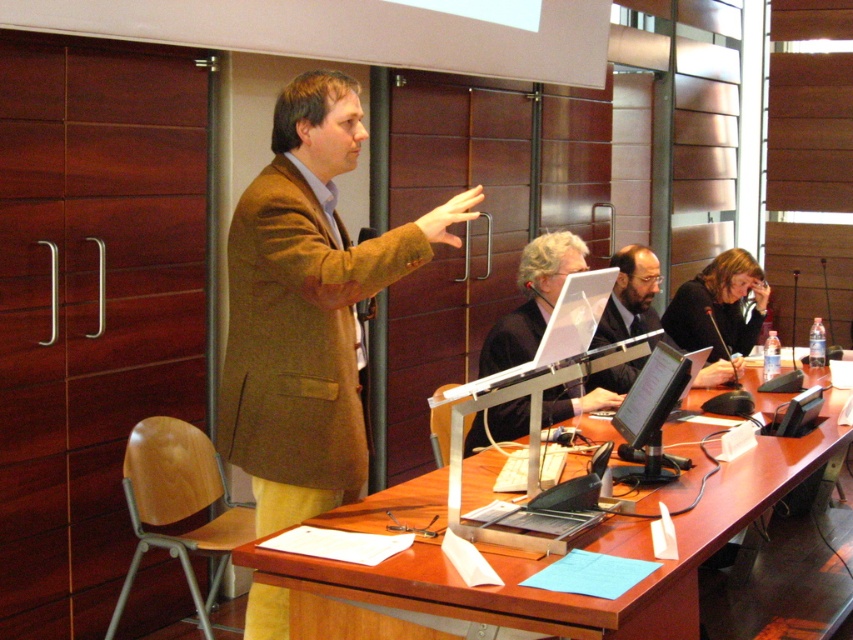
Question: Among these objects, which one is farthest from the camera?

Choices:
 (A) brown woolen blazer at center
 (B) brown wooden table at center

Answer: (A)

Question: Among these points, which one is farthest from the camera?

Choices:
 (A) (494, 609)
 (B) (699, 344)

Answer: (B)

Question: Does brown woolen blazer at center have a larger size compared to matte black laptop at center?

Choices:
 (A) yes
 (B) no

Answer: (A)

Question: Does brown wooden table at center have a greater width compared to matte black laptop at center?

Choices:
 (A) yes
 (B) no

Answer: (A)

Question: Does brown wooden table at center appear on the right side of matte black suit at center?

Choices:
 (A) yes
 (B) no

Answer: (B)

Question: Which object appears closest to the camera in this image?

Choices:
 (A) matte black suit at center
 (B) matte black laptop at center
 (C) brown woolen blazer at center

Answer: (C)